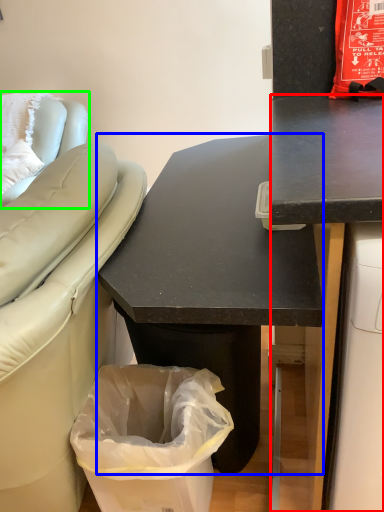
Question: Based on their relative distances, which object is nearer to desk (highlighted by a red box)? Choose from desk (highlighted by a blue box) and furniture (highlighted by a green box).

Choices:
 (A) desk
 (B) furniture

Answer: (A)